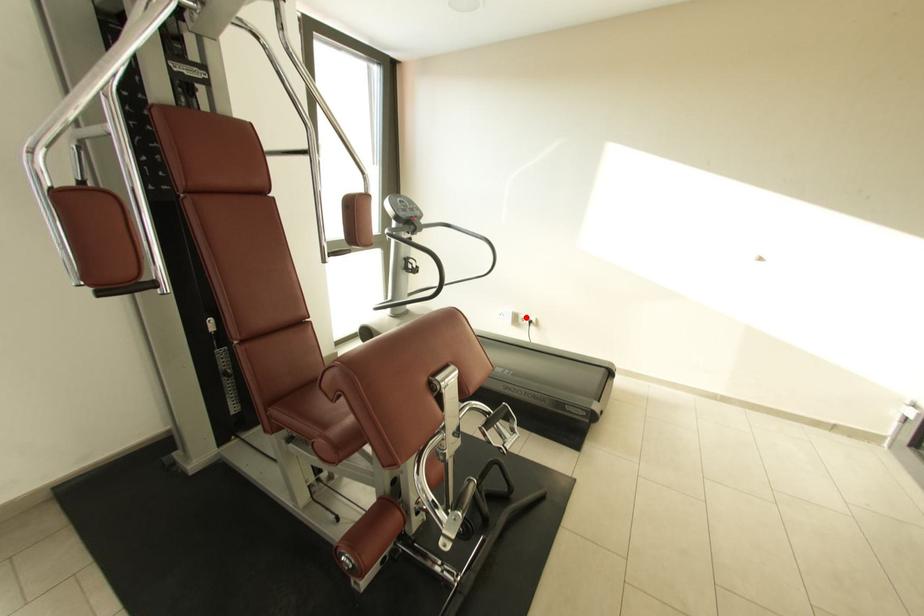
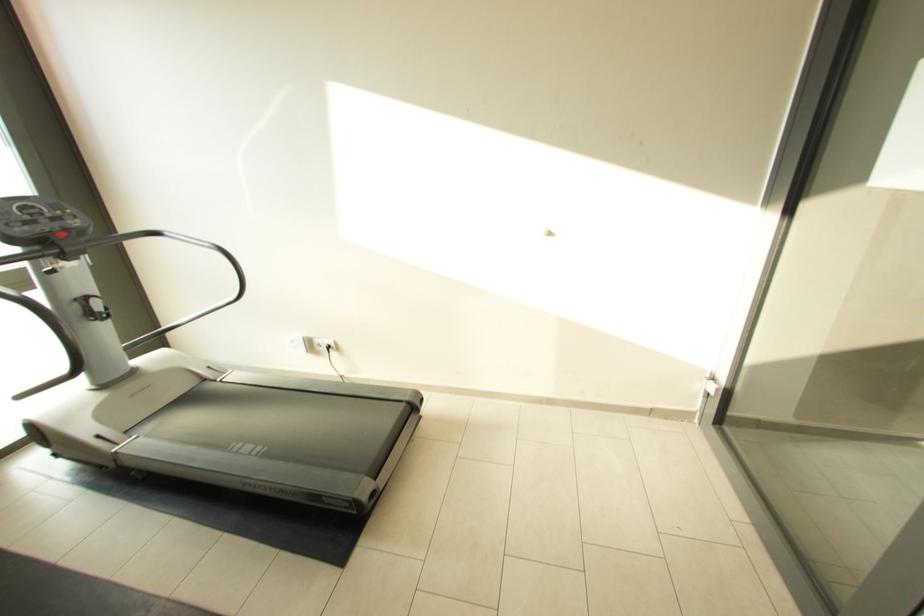
Find the pixel in the second image that matches the highlighted location in the first image.

(322, 342)